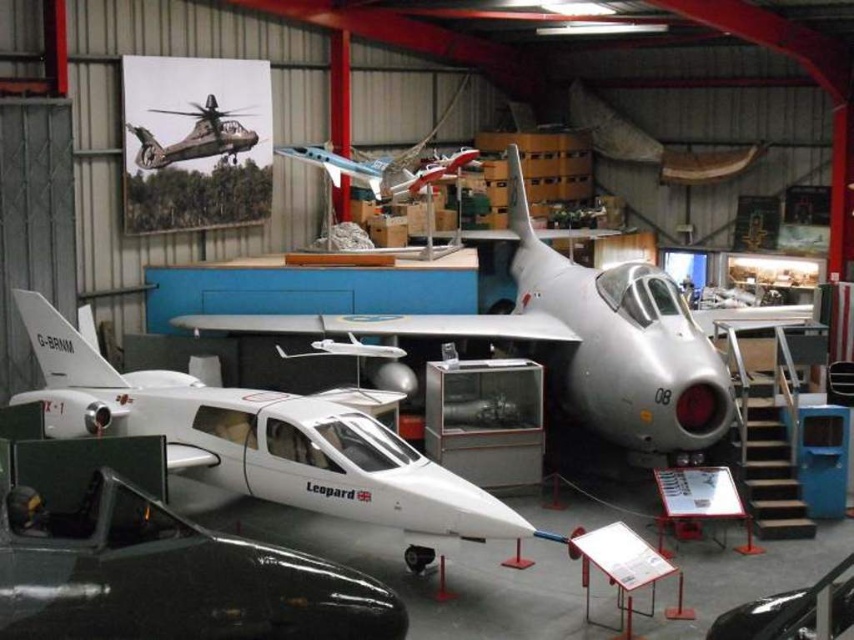
You are a museum visitor standing in the center of the hangar. You want to take a photo of both the glossy white airplane at center and the camouflage fabric helicopter at upper left. Which object should you focus on first if you want to ensure both are in the frame without moving your camera?

The glossy white airplane at center is not as tall as the camouflage fabric helicopter at upper left, so you should focus on the camouflage fabric helicopter at upper left first to ensure both fit in the frame.

From the picture: You are an aviation enthusiast visiting the museum. You want to take a photo of both the metallic blue airplane at center and the camouflage fabric helicopter at upper left. Which object should you focus on first to ensure both fit in the frame?

The metallic blue airplane at center is wider than the camouflage fabric helicopter at upper left, so you should focus on the metallic blue airplane at center first to ensure both fit in the frame.

As a visitor standing at the entrance of the museum, you want to take a photo of the point at coordinate point (303,150). Is this point within your camera frame if your camera has a 50mm lens and a field of view of 46 degrees?

The point at coordinate point (303,150) is 16.34 meters from the camera. With a 50mm lens and a 46 degree field of view, the maximum distance at which the camera can capture objects within its frame is approximately 16.34 meters. Therefore, the point is exactly at the edge of the camera frame and may be partially visible depending on the exact positioning.